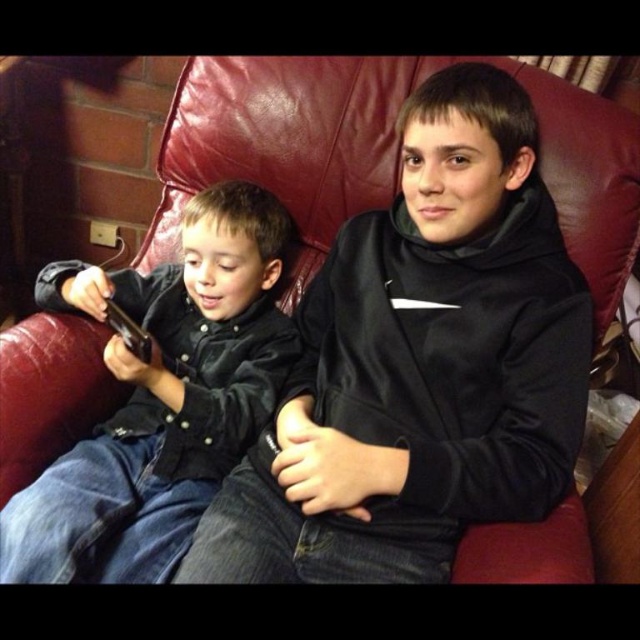
Question: Among these objects, which one is nearest to the camera?

Choices:
 (A) black matte hoodie at center
 (B) matte black shirt at left

Answer: (B)

Question: Can you confirm if black matte hoodie at center is positioned to the left of matte black shirt at left?

Choices:
 (A) no
 (B) yes

Answer: (A)

Question: Is black matte hoodie at center bigger than matte black shirt at left?

Choices:
 (A) no
 (B) yes

Answer: (B)

Question: Does black matte hoodie at center appear under matte black shirt at left?

Choices:
 (A) yes
 (B) no

Answer: (B)

Question: Which point is farther from the camera taking this photo?

Choices:
 (A) (296, 452)
 (B) (128, 486)

Answer: (B)